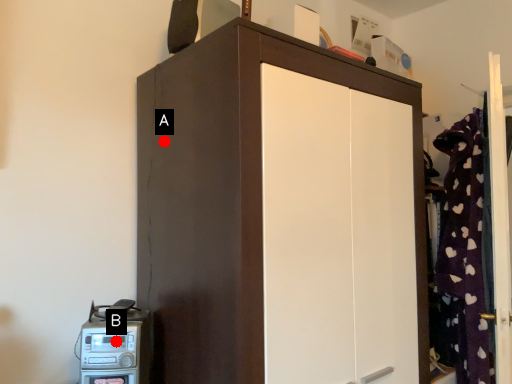
Question: Two points are circled on the image, labeled by A and B beside each circle. Which point is closer to the camera?

Choices:
 (A) A is closer
 (B) B is closer

Answer: (B)